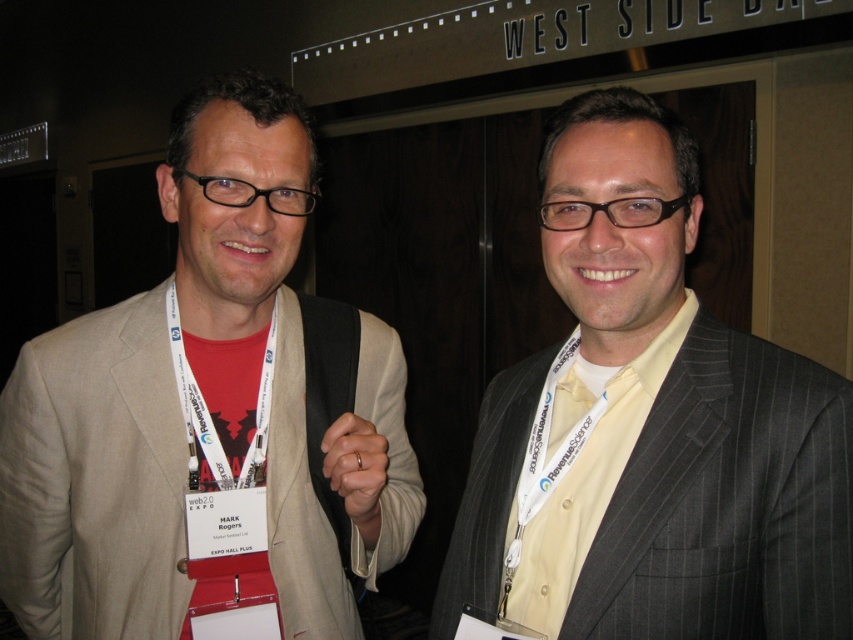
You are standing in front of the two people in the image. Which of the two points, point (614, 90) or point (229, 301), is closer to you?

Point (614, 90) is closer to the viewer than point (229, 301).

Based on the scene description, which object is taller between the gray pinstripe suit at center and the red matte neck at center?

The gray pinstripe suit at center is much taller than the red matte neck at center.